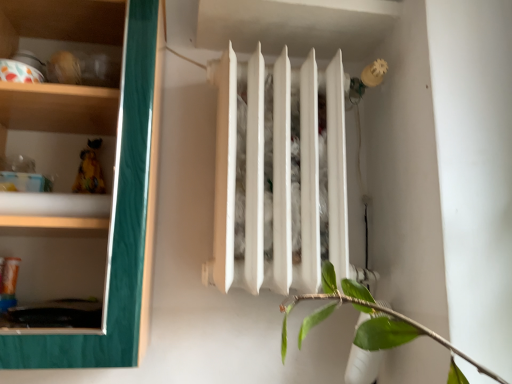
Image resolution: width=512 pixels, height=384 pixels. What do you see at coordinates (263, 181) in the screenshot?
I see `white matte radiator at center` at bounding box center [263, 181].

Locate an element on the screen. This screenshot has width=512, height=384. white matte radiator at center is located at coordinates (263, 181).

I want to click on white matte radiator at center, so (x=263, y=181).